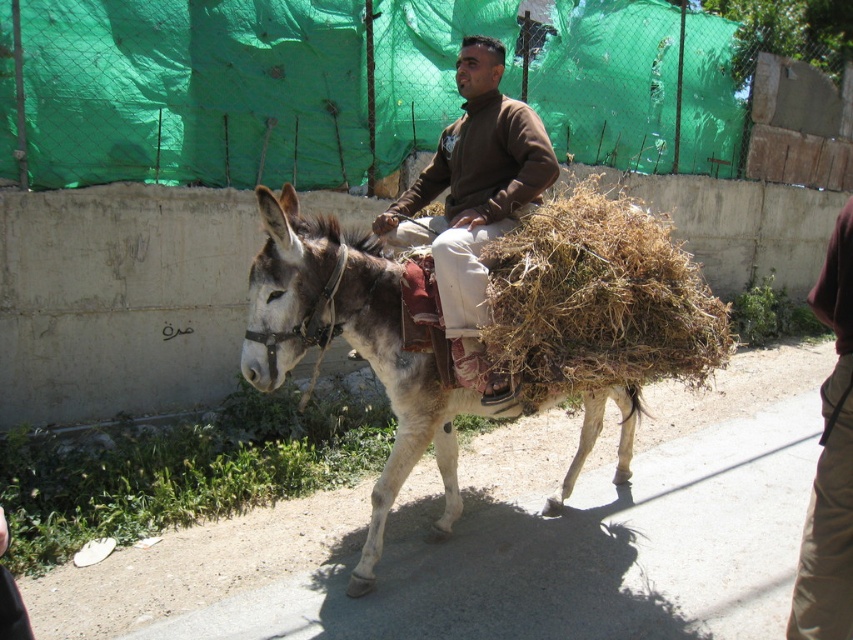
In the scene shown: What is the 2D coordinate of the brown dry grass at center?

The brown dry grass at center is located at the 2D coordinate point of (598,298).

You are a drone operator trying to capture a photo of the man and his donkey. The drone is currently hovering at point 0.5, 0.5. To avoid the brown dry grass at center, which is located at 0.466, 0.702, you need to adjust the drone to a new position. Which direction should you move the drone to ensure it stays clear of the grass?

The brown dry grass at center is located at point [598,298]. Since the drone is at [426,320], moving it slightly to the right and down would keep it away from the grass.